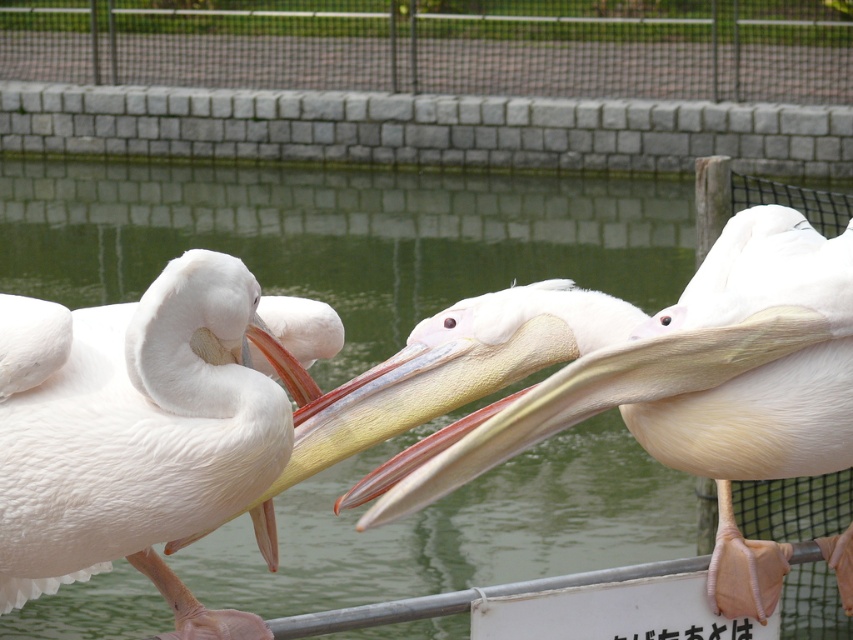
Who is more forward, (x=422, y=420) or (x=166, y=577)?

Point (x=422, y=420) is more forward.

Between white smooth pelican at center and white feathered pelican at center, which one appears on the right side from the viewer's perspective?

From the viewer's perspective, white smooth pelican at center appears more on the right side.

This screenshot has width=853, height=640. In order to click on white smooth pelican at center in this screenshot , I will do `click(619, 372)`.

Is point (4, 355) farther from viewer compared to point (119, 16)?

No, (4, 355) is in front of (119, 16).

Does point (68, 547) come in front of point (454, 36)?

Yes, point (68, 547) is closer to viewer.

Where is `white feathered pelican at center`? white feathered pelican at center is located at coordinates (137, 429).

Who is more forward, (560, 324) or (831, 26)?

Point (560, 324) is more forward.

Can you confirm if white smooth pelican at center is bigger than metal mesh fence at upper center?

Actually, white smooth pelican at center might be smaller than metal mesh fence at upper center.

Where is `white smooth pelican at center`? white smooth pelican at center is located at coordinates (619, 372).